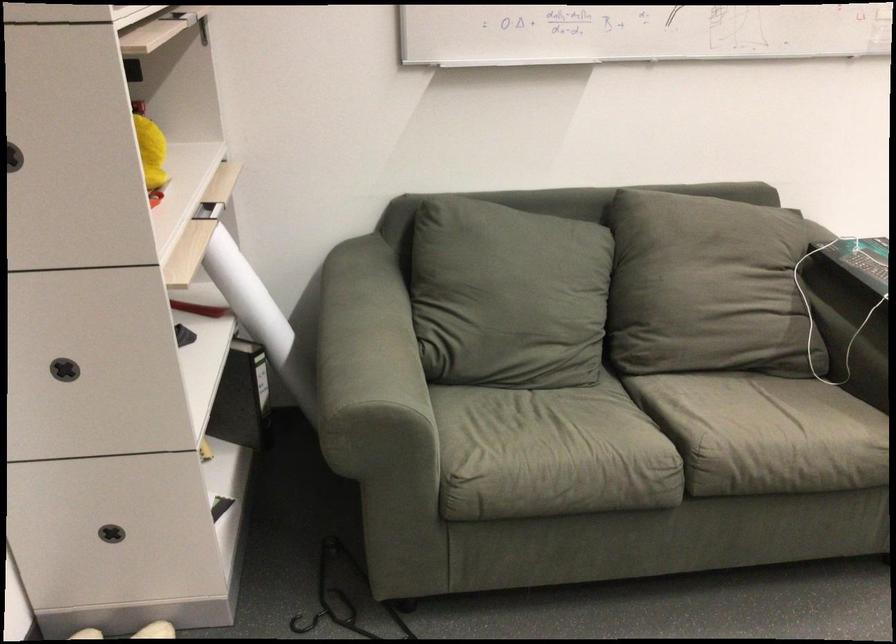
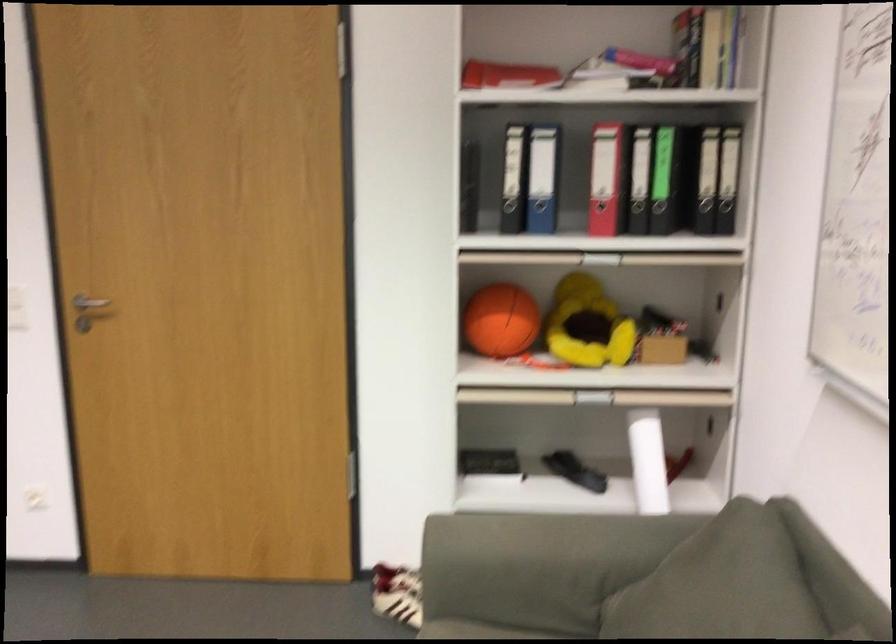
Locate, in the second image, the point that corresponds to point (79, 165) in the first image.

(501, 321)